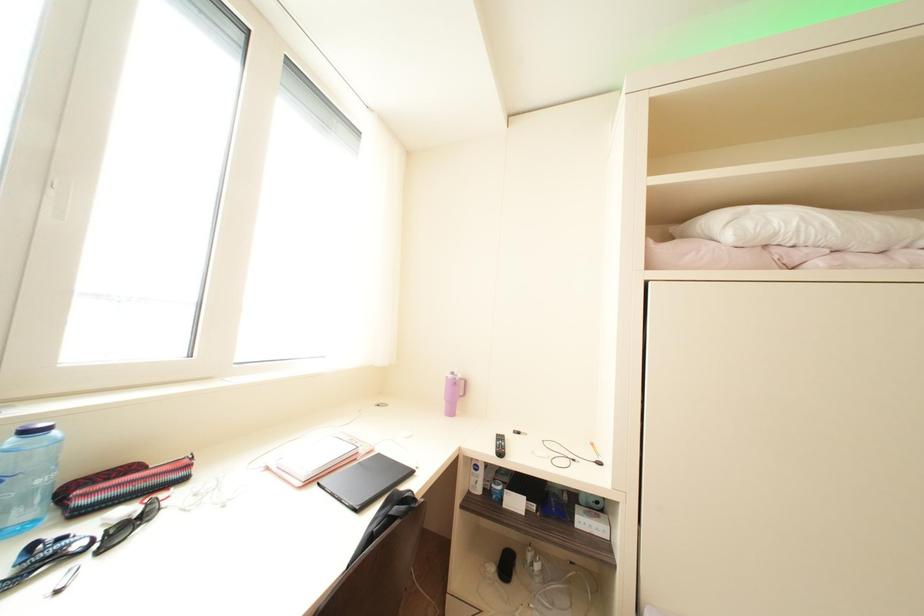
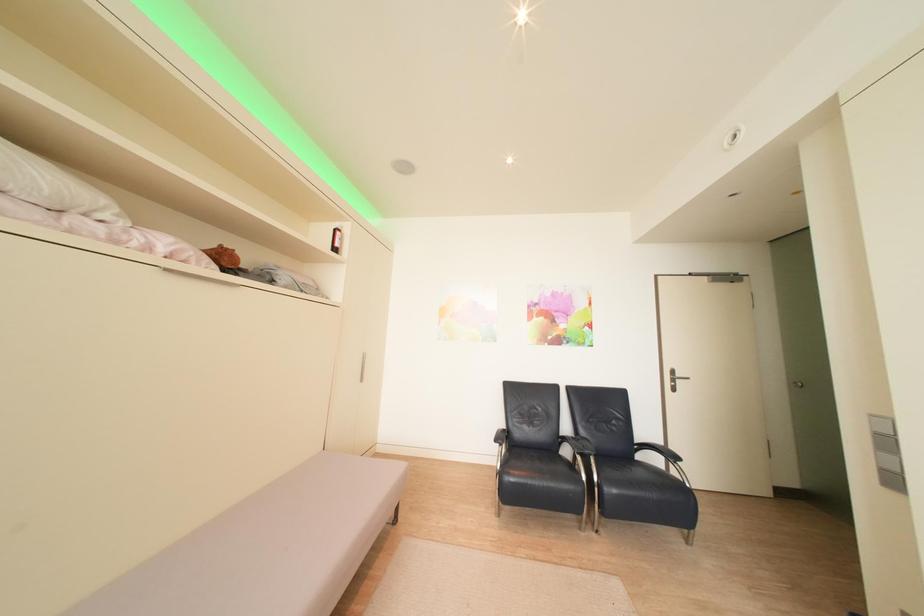
Question: Based on the continuous images, in which direction is the camera rotating? Reply with the corresponding letter.

Choices:
 (A) Left
 (B) Right
 (C) Up
 (D) Down

Answer: (B)